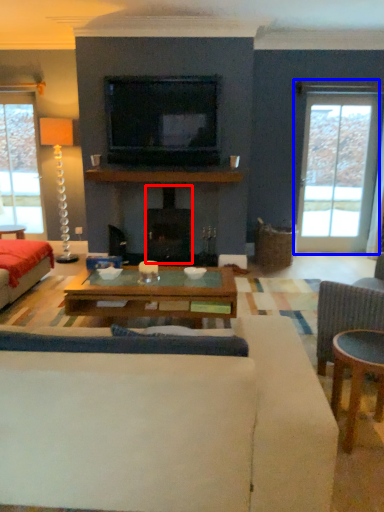
Question: Which of the following is the farthest to the observer, fireplace (highlighted by a red box) or window (highlighted by a blue box)?

Choices:
 (A) fireplace
 (B) window

Answer: (B)